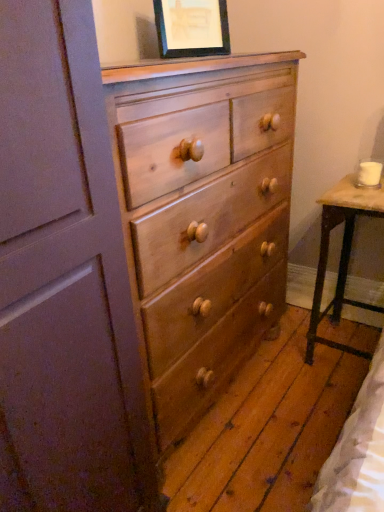
Where is `light brown wood chest of drawers at center`? This screenshot has height=512, width=384. light brown wood chest of drawers at center is located at coordinates (203, 219).

Based on their sizes in the image, would you say light brown wood chest of drawers at center is bigger or smaller than wooden table at right?

light brown wood chest of drawers at center is bigger than wooden table at right.

Is light brown wood chest of drawers at center positioned with its back to wooden table at right?

No, light brown wood chest of drawers at center's orientation is not away from wooden table at right.

This screenshot has height=512, width=384. I want to click on table below the matte black picture frame at upper center (from a real-world perspective), so click(x=341, y=253).

Would you consider matte black picture frame at upper center to be distant from wooden table at right?

No.

In terms of height, does matte black picture frame at upper center look taller or shorter compared to wooden table at right?

matte black picture frame at upper center is shorter than wooden table at right.

Can you confirm if matte black picture frame at upper center is thinner than wooden table at right?

Yes.

Is matte black picture frame at upper center at the back of wooden table at right?

No, wooden table at right is not facing the opposite direction of matte black picture frame at upper center.

Which is correct: wooden table at right is inside matte black picture frame at upper center, or outside of it?

The correct answer is: outside.

From the image's perspective, is wooden table at right below matte black picture frame at upper center?

Yes, from the image's perspective, wooden table at right is below matte black picture frame at upper center.

In terms of height, does wooden table at right look taller or shorter compared to matte black picture frame at upper center?

In the image, wooden table at right appears to be taller than matte black picture frame at upper center.

Considering the relative sizes of matte black picture frame at upper center and light brown wood chest of drawers at center in the image provided, is matte black picture frame at upper center taller than light brown wood chest of drawers at center?

No.

Is matte black picture frame at upper center with light brown wood chest of drawers at center?

There is a gap between matte black picture frame at upper center and light brown wood chest of drawers at center.

From a real-world perspective, is matte black picture frame at upper center positioned over light brown wood chest of drawers at center based on gravity?

Yes, from a real-world perspective, matte black picture frame at upper center is above light brown wood chest of drawers at center.

From the image's perspective, which object appears higher, matte black picture frame at upper center or light brown wood chest of drawers at center?

matte black picture frame at upper center is shown above in the image.

Based on the photo, how different are the orientations of wooden table at right and light brown wood chest of drawers at center in degrees?

The facing directions of wooden table at right and light brown wood chest of drawers at center are 90.4 degrees apart.

In the image, is wooden table at right positioned in front of or behind light brown wood chest of drawers at center?

In the image, wooden table at right appears behind light brown wood chest of drawers at center.

From the image's perspective, is wooden table at right beneath light brown wood chest of drawers at center?

Yes.

Is wooden table at right taller or shorter than light brown wood chest of drawers at center?

In the image, wooden table at right appears to be shorter than light brown wood chest of drawers at center.

Which is behind, light brown wood chest of drawers at center or matte black picture frame at upper center?

matte black picture frame at upper center.

In the image, is light brown wood chest of drawers at center on the left side or the right side of matte black picture frame at upper center?

light brown wood chest of drawers at center is positioned on matte black picture frame at upper center's left side.

From a real-world perspective, is light brown wood chest of drawers at center positioned above or below matte black picture frame at upper center?

light brown wood chest of drawers at center is below matte black picture frame at upper center.

Where is `table that appears behind the light brown wood chest of drawers at center`? This screenshot has height=512, width=384. table that appears behind the light brown wood chest of drawers at center is located at coordinates (341, 253).

You are a GUI agent. You are given a task and a screenshot of the screen. Output one action in this format:
    pyautogui.click(x=<x>, y=<y>)
    Task: Click on the table on the right of matte black picture frame at upper center
    Image resolution: width=384 pixels, height=512 pixels.
    Given the screenshot: What is the action you would take?
    pyautogui.click(x=341, y=253)

Considering their positions, is light brown wood chest of drawers at center positioned closer to matte black picture frame at upper center than wooden table at right?

The object closer to matte black picture frame at upper center is light brown wood chest of drawers at center.

Looking at the image, which one is located further to wooden table at right, matte black picture frame at upper center or light brown wood chest of drawers at center?

matte black picture frame at upper center lies further to wooden table at right than the other object.

When comparing their distances from matte black picture frame at upper center, does wooden table at right or light brown wood chest of drawers at center seem closer?

Among the two, light brown wood chest of drawers at center is located nearer to matte black picture frame at upper center.

Based on the photo, considering their positions, is wooden table at right positioned closer to light brown wood chest of drawers at center than matte black picture frame at upper center?

Among the two, wooden table at right is located nearer to light brown wood chest of drawers at center.

Estimate the real-world distances between objects in this image. Which object is closer to light brown wood chest of drawers at center, matte black picture frame at upper center or wooden table at right?

wooden table at right is closer to light brown wood chest of drawers at center.

When comparing their distances from wooden table at right, does light brown wood chest of drawers at center or matte black picture frame at upper center seem closer?

light brown wood chest of drawers at center is closer to wooden table at right.

Locate an element on the screen. The height and width of the screenshot is (512, 384). the chest of drawers between matte black picture frame at upper center and wooden table at right vertically is located at coordinates click(x=203, y=219).